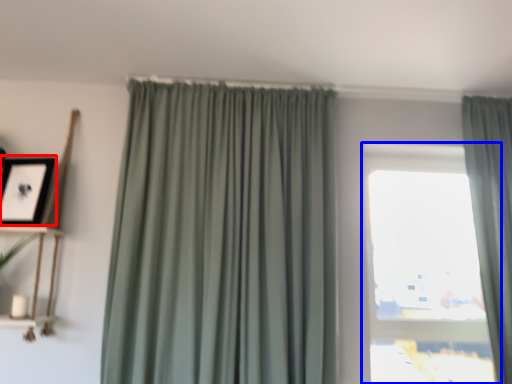
Question: Among these objects, which one is farthest to the camera, picture frame (highlighted by a red box) or window (highlighted by a blue box)?

Choices:
 (A) picture frame
 (B) window

Answer: (B)